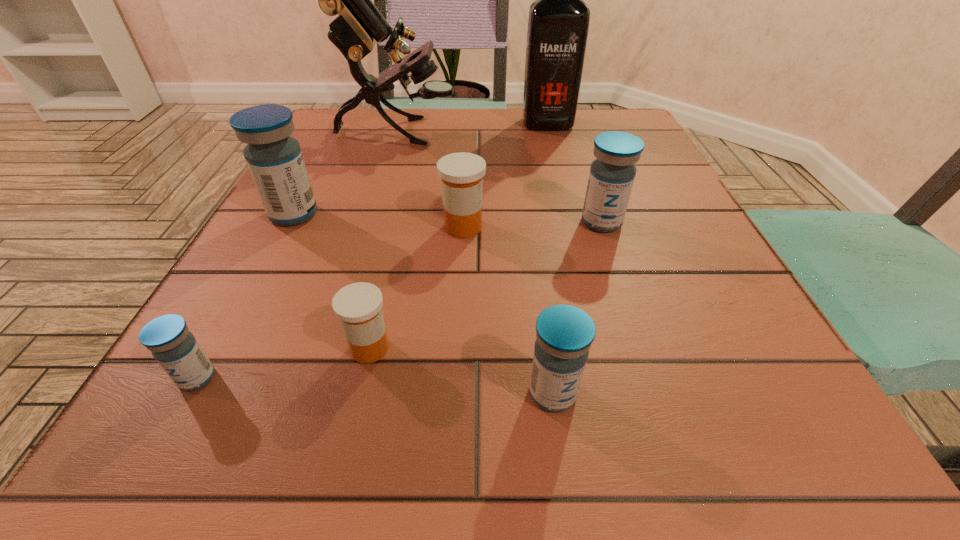
The height and width of the screenshot is (540, 960). I want to click on the nearer orange medicine, so click(x=359, y=305).

This screenshot has height=540, width=960. I want to click on the left orange medicine, so click(359, 305).

I want to click on the smallest blue medicine, so click(x=174, y=347).

Locate an element on the screen. The width and height of the screenshot is (960, 540). vacant space situated 0.090m on the front-facing side of the liquor is located at coordinates (555, 151).

The height and width of the screenshot is (540, 960). I want to click on vacant region located 0.250m through the eyepiece of the microscope, so click(x=564, y=131).

What are the coordinates of `vacant area situated on the back of the third tallest object` in the screenshot? It's located at (330, 145).

Where is `free location located on the right of the second tallest medicine`? free location located on the right of the second tallest medicine is located at coordinates (663, 222).

Image resolution: width=960 pixels, height=540 pixels. In order to click on vacant space located on the label of the right orange medicine in this screenshot , I will do `click(637, 227)`.

The image size is (960, 540). Identify the location of free space located on the back of the third biggest blue medicine. (545, 340).

Image resolution: width=960 pixels, height=540 pixels. I want to click on vacant space positioned on the label of the nearer orange medicine, so click(x=548, y=348).